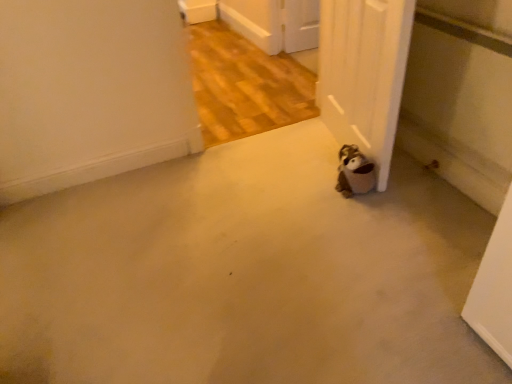
This screenshot has height=384, width=512. In order to click on unoccupied area in front of white matte door at lower right in this screenshot , I will do point(362,217).